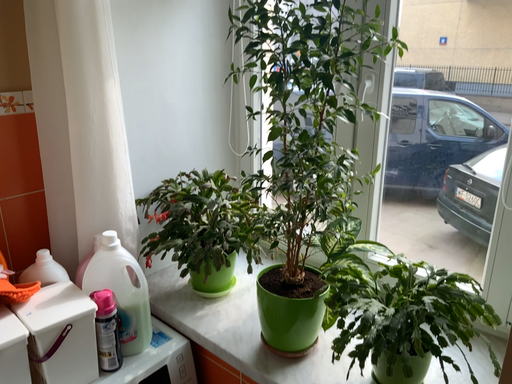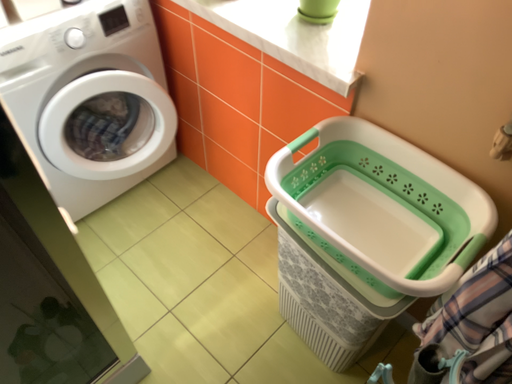
Question: Which way did the camera rotate in the video?

Choices:
 (A) rotated downward
 (B) rotated upward

Answer: (A)